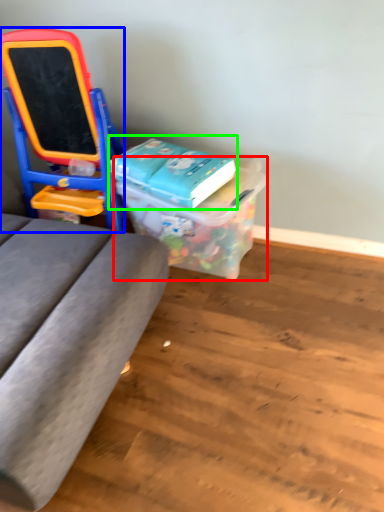
Question: Which is farther away from box (highlighted by a red box)? furniture (highlighted by a blue box) or book (highlighted by a green box)?

Choices:
 (A) furniture
 (B) book

Answer: (A)